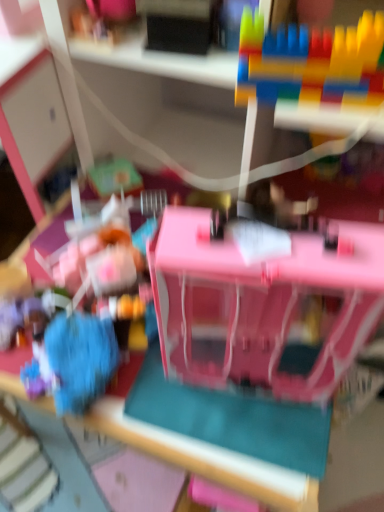
Question: From a real-world perspective, relative to multicolored plastic blocks at upper right, placed as the third toy when sorted from left to right, is blue fuzzy ball at lower left, the 3th toy when ordered from top to bottom, vertically above or below?

Choices:
 (A) above
 (B) below

Answer: (B)

Question: Is point (102, 374) positioned closer to the camera than point (292, 28)?

Choices:
 (A) closer
 (B) farther

Answer: (B)

Question: Estimate the real-world distances between objects in this image. Which object is farther from the multicolored plastic blocks at upper right, placed as the 1th toy when sorted from right to left?

Choices:
 (A) pink plastic dollhouse at center, the second toy viewed from the right
 (B) blue fuzzy ball at lower left, the 3th toy from the right

Answer: (B)

Question: Estimate the real-world distances between objects in this image. Which object is farther from the pink plastic dollhouse at center, arranged as the second toy when viewed from the left?

Choices:
 (A) blue fuzzy ball at lower left, which is the 1th toy from left to right
 (B) multicolored plastic blocks at upper right, acting as the 1th toy starting from the top

Answer: (B)